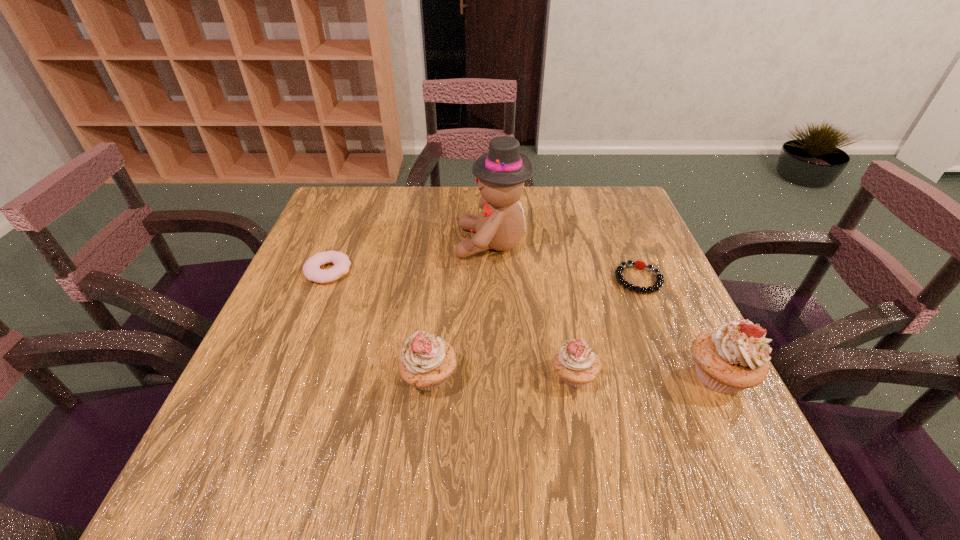
I want to click on the second closest cupcake to the shortest object, so click(x=576, y=364).

Point out which cupcake is positioned as the third nearest to the tallest object. Please provide its 2D coordinates. Your answer should be formatted as a tuple, i.e. [(x, y)], where the tuple contains the x and y coordinates of a point satisfying the conditions above.

[(733, 357)]

Identify the location of vacant space that satisfies the following two spatial constraints: 1. on the front-facing side of the rag_doll; 2. on the right side of the second cupcake from left to right. (496, 376).

Locate an element on the screen. blank space that satisfies the following two spatial constraints: 1. on the front-facing side of the rag_doll; 2. on the right side of the third object from right to left is located at coordinates (496, 376).

This screenshot has height=540, width=960. What are the coordinates of `free location that satisfies the following two spatial constraints: 1. on the back side of the fifth shortest object; 2. on the front-facing side of the rag_doll` in the screenshot? It's located at (654, 243).

I want to click on free location that satisfies the following two spatial constraints: 1. on the front-facing side of the tallest object; 2. on the back side of the bracelet, so click(x=493, y=279).